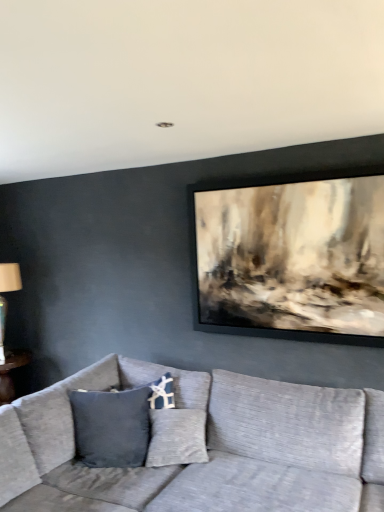
Question: Is textured gray couch at center taller than white fabric lampshade at left?

Choices:
 (A) yes
 (B) no

Answer: (B)

Question: Is textured gray couch at center to the right of white fabric lampshade at left from the viewer's perspective?

Choices:
 (A) yes
 (B) no

Answer: (A)

Question: Is textured gray couch at center looking in the opposite direction of white fabric lampshade at left?

Choices:
 (A) no
 (B) yes

Answer: (A)

Question: Is textured gray couch at center outside of white fabric lampshade at left?

Choices:
 (A) yes
 (B) no

Answer: (A)

Question: Is textured gray couch at center positioned in front of white fabric lampshade at left?

Choices:
 (A) yes
 (B) no

Answer: (A)

Question: Can you confirm if textured gray couch at center is positioned to the left of white fabric lampshade at left?

Choices:
 (A) yes
 (B) no

Answer: (B)

Question: Are white fabric lampshade at left and textured gray couch at center beside each other?

Choices:
 (A) no
 (B) yes

Answer: (A)

Question: Does white fabric lampshade at left appear on the left side of textured gray couch at center?

Choices:
 (A) no
 (B) yes

Answer: (B)

Question: From the image's perspective, is white fabric lampshade at left beneath textured gray couch at center?

Choices:
 (A) yes
 (B) no

Answer: (B)

Question: Does white fabric lampshade at left have a greater width compared to textured gray couch at center?

Choices:
 (A) yes
 (B) no

Answer: (B)

Question: Is white fabric lampshade at left facing towards textured gray couch at center?

Choices:
 (A) no
 (B) yes

Answer: (A)

Question: Is textured gray couch at center a part of white fabric lampshade at left?

Choices:
 (A) no
 (B) yes

Answer: (A)

Question: Considering the positions of point (292, 434) and point (1, 364), is point (292, 434) closer or farther from the camera than point (1, 364)?

Choices:
 (A) closer
 (B) farther

Answer: (A)